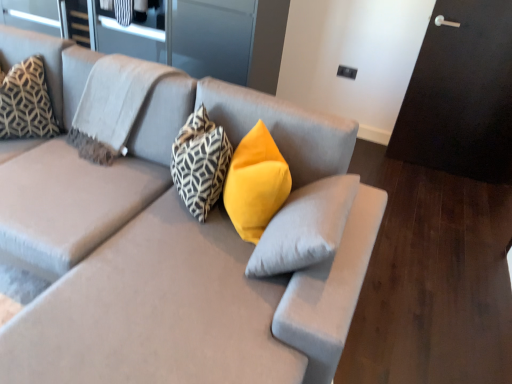
The image size is (512, 384). What are the coordinates of `yellow velvet pillow at center, placed as the 1th pillow when sorted from right to left` in the screenshot? It's located at (256, 183).

Describe the element at coordinates (27, 102) in the screenshot. I see `geometric-patterned fabric pillow at upper left, which is the 1th pillow from left to right` at that location.

The width and height of the screenshot is (512, 384). Identify the location of geometric-patterned fabric pillow at center, which is the second pillow in right-to-left order. (200, 163).

Locate an element on the screen. The height and width of the screenshot is (384, 512). matte gray couch at center is located at coordinates (181, 254).

Between point (81, 84) and point (147, 68), which one is positioned behind?

The point (81, 84) is more distant.

Measure the distance from matte gray couch at center to patterned fabric pillow at upper left, the 3th pillow in the right-to-left sequence.

11.82 inches.

Can you tell me how much matte gray couch at center and patterned fabric pillow at upper left, the 3th pillow in the right-to-left sequence, differ in facing direction?

The facing directions of matte gray couch at center and patterned fabric pillow at upper left, the 3th pillow in the right-to-left sequence, are 1.71 degrees apart.

Looking at this image, is matte gray couch at center wider or thinner than patterned fabric pillow at upper left, which appears as the second pillow when viewed from the left?

Considering their sizes, matte gray couch at center looks broader than patterned fabric pillow at upper left, which appears as the second pillow when viewed from the left.

Which of these two, matte gray couch at center or geometric-patterned fabric pillow at upper left, the 4th pillow viewed from the right, is smaller?

With smaller size is geometric-patterned fabric pillow at upper left, the 4th pillow viewed from the right.

Are matte gray couch at center and geometric-patterned fabric pillow at upper left, the 4th pillow viewed from the right, beside each other?

They are not placed beside each other.

In the scene shown: Between matte gray couch at center and geometric-patterned fabric pillow at upper left, which is the 1th pillow from left to right, which one appears on the left side from the viewer's perspective?

Positioned to the left is geometric-patterned fabric pillow at upper left, which is the 1th pillow from left to right.

Is matte gray couch at center facing towards geometric-patterned fabric pillow at upper left, the 4th pillow viewed from the right?

No.

From a real-world perspective, is yellow velvet pillow at center, placed as the 1th pillow when sorted from right to left, on top of matte gray couch at center?

Result: Correct, in the physical world, yellow velvet pillow at center, placed as the 1th pillow when sorted from right to left, is higher than matte gray couch at center.

In terms of height, does yellow velvet pillow at center, placed as the 1th pillow when sorted from right to left, look taller or shorter compared to matte gray couch at center?

Clearly, yellow velvet pillow at center, placed as the 1th pillow when sorted from right to left, is shorter compared to matte gray couch at center.

Relative to matte gray couch at center, is yellow velvet pillow at center, arranged as the 4th pillow when viewed from the left, in front or behind?

yellow velvet pillow at center, arranged as the 4th pillow when viewed from the left, is behind matte gray couch at center.

Is geometric-patterned fabric pillow at center, acting as the 3th pillow starting from the left, inside or outside of geometric-patterned fabric pillow at upper left, which is the 1th pillow from left to right?

geometric-patterned fabric pillow at center, acting as the 3th pillow starting from the left, is located beyond the bounds of geometric-patterned fabric pillow at upper left, which is the 1th pillow from left to right.

How distant is geometric-patterned fabric pillow at center, which is the second pillow in right-to-left order, from geometric-patterned fabric pillow at upper left, the 4th pillow viewed from the right?

34.64 inches.

Is geometric-patterned fabric pillow at center, acting as the 3th pillow starting from the left, placed right next to geometric-patterned fabric pillow at upper left, which is the 1th pillow from left to right?

They are not placed beside each other.

Which is more to the left, geometric-patterned fabric pillow at center, which is the second pillow in right-to-left order, or geometric-patterned fabric pillow at upper left, the 4th pillow viewed from the right?

geometric-patterned fabric pillow at upper left, the 4th pillow viewed from the right, is more to the left.

Identify the location of pillow that is the 2nd object located in front of the geometric-patterned fabric pillow at upper left, which is the 1th pillow from left to right. The image size is (512, 384). (200, 163).

Does geometric-patterned fabric pillow at upper left, the 4th pillow viewed from the right, have a lesser width compared to geometric-patterned fabric pillow at center, which is the second pillow in right-to-left order?

No, geometric-patterned fabric pillow at upper left, the 4th pillow viewed from the right, is not thinner than geometric-patterned fabric pillow at center, which is the second pillow in right-to-left order.

Is geometric-patterned fabric pillow at upper left, the 4th pillow viewed from the right, situated inside geometric-patterned fabric pillow at center, acting as the 3th pillow starting from the left, or outside?

geometric-patterned fabric pillow at upper left, the 4th pillow viewed from the right, is outside geometric-patterned fabric pillow at center, acting as the 3th pillow starting from the left.

Considering the relative sizes of matte gray couch at center and yellow velvet pillow at center, arranged as the 4th pillow when viewed from the left, in the image provided, is matte gray couch at center bigger than yellow velvet pillow at center, arranged as the 4th pillow when viewed from the left,?

Answer: Yes, matte gray couch at center is bigger than yellow velvet pillow at center, arranged as the 4th pillow when viewed from the left.

Is matte gray couch at center looking in the opposite direction of yellow velvet pillow at center, placed as the 1th pillow when sorted from right to left?

Yes, matte gray couch at center's orientation is away from yellow velvet pillow at center, placed as the 1th pillow when sorted from right to left.

Consider the image. Considering the positions of objects matte gray couch at center and yellow velvet pillow at center, arranged as the 4th pillow when viewed from the left, in the image provided, who is behind, matte gray couch at center or yellow velvet pillow at center, arranged as the 4th pillow when viewed from the left,?

yellow velvet pillow at center, arranged as the 4th pillow when viewed from the left, is more distant.

This screenshot has width=512, height=384. What are the coordinates of `the 1st pillow behind the matte gray couch at center, counting from the anchor's position` in the screenshot? It's located at (256, 183).

Considering the relative sizes of matte gray couch at center and geometric-patterned fabric pillow at center, acting as the 3th pillow starting from the left, in the image provided, is matte gray couch at center thinner than geometric-patterned fabric pillow at center, acting as the 3th pillow starting from the left,?

Incorrect, the width of matte gray couch at center is not less than that of geometric-patterned fabric pillow at center, acting as the 3th pillow starting from the left.

At what (x,y) coordinates should I click in order to perform the action: click on the 2nd pillow behind the matte gray couch at center. Please return your answer as a coordinate pair (x, y). Image resolution: width=512 pixels, height=384 pixels. Looking at the image, I should click on (200, 163).

Is geometric-patterned fabric pillow at center, which is the second pillow in right-to-left order, inside matte gray couch at center?

Indeed, geometric-patterned fabric pillow at center, which is the second pillow in right-to-left order, is located within matte gray couch at center.

Can you tell me how much matte gray couch at center and geometric-patterned fabric pillow at center, acting as the 3th pillow starting from the left, differ in facing direction?

44.6 degrees separate the facing orientations of matte gray couch at center and geometric-patterned fabric pillow at center, acting as the 3th pillow starting from the left.

At what (x,y) coordinates should I click in order to perform the action: click on pillow that is the 4th one above the matte gray couch at center (from a real-world perspective). Please return your answer as a coordinate pair (x, y). Looking at the image, I should click on (125, 102).

Image resolution: width=512 pixels, height=384 pixels. I want to click on the 4th pillow behind the matte gray couch at center, counting from the anchor's position, so click(27, 102).

From the picture: Estimate the real-world distances between objects in this image. Which object is closer to matte gray couch at center, patterned fabric pillow at upper left, which appears as the second pillow when viewed from the left, or yellow velvet pillow at center, arranged as the 4th pillow when viewed from the left?

Based on the image, patterned fabric pillow at upper left, which appears as the second pillow when viewed from the left, appears to be nearer to matte gray couch at center.

Based on their spatial positions, is patterned fabric pillow at upper left, the 3th pillow in the right-to-left sequence, or geometric-patterned fabric pillow at upper left, which is the 1th pillow from left to right, further from geometric-patterned fabric pillow at center, which is the second pillow in right-to-left order?

geometric-patterned fabric pillow at upper left, which is the 1th pillow from left to right, is further to geometric-patterned fabric pillow at center, which is the second pillow in right-to-left order.

Estimate the real-world distances between objects in this image. Which object is closer to yellow velvet pillow at center, placed as the 1th pillow when sorted from right to left, patterned fabric pillow at upper left, the 3th pillow in the right-to-left sequence, or matte gray couch at center?

matte gray couch at center lies closer to yellow velvet pillow at center, placed as the 1th pillow when sorted from right to left, than the other object.

Considering their positions, is patterned fabric pillow at upper left, the 3th pillow in the right-to-left sequence, positioned further to geometric-patterned fabric pillow at upper left, which is the 1th pillow from left to right, than yellow velvet pillow at center, placed as the 1th pillow when sorted from right to left?

yellow velvet pillow at center, placed as the 1th pillow when sorted from right to left, is positioned further to the anchor geometric-patterned fabric pillow at upper left, which is the 1th pillow from left to right.

Based on their spatial positions, is geometric-patterned fabric pillow at center, acting as the 3th pillow starting from the left, or matte gray couch at center further from patterned fabric pillow at upper left, which appears as the second pillow when viewed from the left?

The object further to patterned fabric pillow at upper left, which appears as the second pillow when viewed from the left, is geometric-patterned fabric pillow at center, acting as the 3th pillow starting from the left.

Estimate the real-world distances between objects in this image. Which object is further from matte gray couch at center, geometric-patterned fabric pillow at center, which is the second pillow in right-to-left order, or patterned fabric pillow at upper left, the 3th pillow in the right-to-left sequence?

The object further to matte gray couch at center is geometric-patterned fabric pillow at center, which is the second pillow in right-to-left order.

Considering their positions, is geometric-patterned fabric pillow at upper left, which is the 1th pillow from left to right, positioned closer to yellow velvet pillow at center, arranged as the 4th pillow when viewed from the left, than geometric-patterned fabric pillow at center, acting as the 3th pillow starting from the left?

Result: geometric-patterned fabric pillow at center, acting as the 3th pillow starting from the left, is closer to yellow velvet pillow at center, arranged as the 4th pillow when viewed from the left.

Considering their positions, is matte gray couch at center positioned closer to yellow velvet pillow at center, arranged as the 4th pillow when viewed from the left, than geometric-patterned fabric pillow at upper left, which is the 1th pillow from left to right?

matte gray couch at center lies closer to yellow velvet pillow at center, arranged as the 4th pillow when viewed from the left, than the other object.

Image resolution: width=512 pixels, height=384 pixels. What are the coordinates of `pillow situated between patterned fabric pillow at upper left, which appears as the second pillow when viewed from the left, and yellow velvet pillow at center, placed as the 1th pillow when sorted from right to left, from left to right` in the screenshot? It's located at (200, 163).

Locate an element on the screen. pillow between matte gray couch at center and geometric-patterned fabric pillow at center, acting as the 3th pillow starting from the left, from front to back is located at coordinates (256, 183).

The image size is (512, 384). I want to click on pillow between geometric-patterned fabric pillow at upper left, which is the 1th pillow from left to right, and geometric-patterned fabric pillow at center, which is the second pillow in right-to-left order, so click(x=125, y=102).